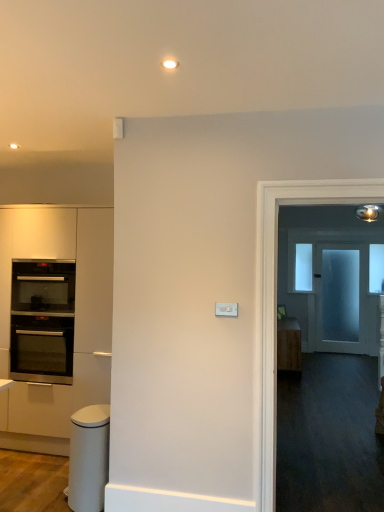
Question: Could transparent glass window at upper right, arranged as the second window when viewed from the back, be considered to be inside white glossy trash can at lower left?

Choices:
 (A) yes
 (B) no

Answer: (B)

Question: Is white glossy trash can at lower left bigger than transparent glass window at upper right, acting as the second window starting from the left?

Choices:
 (A) no
 (B) yes

Answer: (B)

Question: Is white glossy trash can at lower left looking in the opposite direction of transparent glass window at upper right, marked as the 1th window in a right-to-left arrangement?

Choices:
 (A) no
 (B) yes

Answer: (A)

Question: Is white glossy trash can at lower left closer to camera compared to transparent glass window at upper right, marked as the 1th window in a right-to-left arrangement?

Choices:
 (A) no
 (B) yes

Answer: (B)

Question: Considering the relative sizes of white glossy trash can at lower left and transparent glass window at upper right, marked as the 1th window in a right-to-left arrangement, in the image provided, is white glossy trash can at lower left wider than transparent glass window at upper right, marked as the 1th window in a right-to-left arrangement,?

Choices:
 (A) no
 (B) yes

Answer: (B)

Question: From the image's perspective, is white glossy trash can at lower left under transparent glass window at upper right, arranged as the second window when viewed from the back?

Choices:
 (A) yes
 (B) no

Answer: (A)

Question: Is transparent glass window at upper center, the 2th window positioned from the front, inside wooden cabinet at right, the 2th cabinetry positioned from the front?

Choices:
 (A) yes
 (B) no

Answer: (B)

Question: Is wooden cabinet at right, which appears as the second cabinetry when viewed from the left, turned away from transparent glass window at upper center, the 2th window positioned from the front?

Choices:
 (A) yes
 (B) no

Answer: (B)

Question: From the image's perspective, would you say wooden cabinet at right, marked as the 1th cabinetry in a back-to-front arrangement, is positioned over transparent glass window at upper center, placed as the 1th window when sorted from back to front?

Choices:
 (A) no
 (B) yes

Answer: (A)

Question: Is wooden cabinet at right, marked as the 1th cabinetry in a back-to-front arrangement, bigger than transparent glass window at upper center, placed as the 1th window when sorted from back to front?

Choices:
 (A) no
 (B) yes

Answer: (B)

Question: Is wooden cabinet at right, the 2th cabinetry positioned from the front, shorter than transparent glass window at upper center, the first window when ordered from left to right?

Choices:
 (A) yes
 (B) no

Answer: (A)

Question: Is wooden cabinet at right, the 2th cabinetry positioned from the front, positioned in front of transparent glass window at upper center, the 2th window positioned from the front?

Choices:
 (A) no
 (B) yes

Answer: (B)

Question: Considering the relative sizes of transparent glass window at upper center, the first window when ordered from left to right, and white glossy trash can at lower left in the image provided, is transparent glass window at upper center, the first window when ordered from left to right, taller than white glossy trash can at lower left?

Choices:
 (A) yes
 (B) no

Answer: (A)